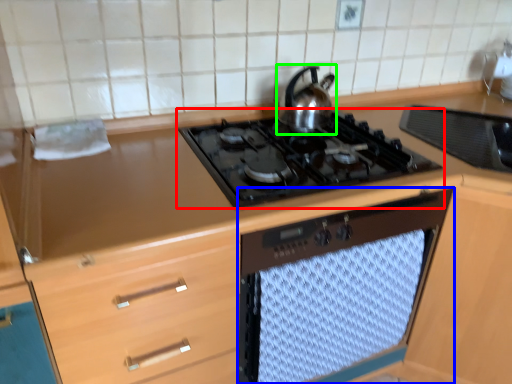
Question: Which object is positioned farthest from gas stove (highlighted by a red box)? Select from oven (highlighted by a blue box) and kitchen appliance (highlighted by a green box).

Choices:
 (A) oven
 (B) kitchen appliance

Answer: (A)